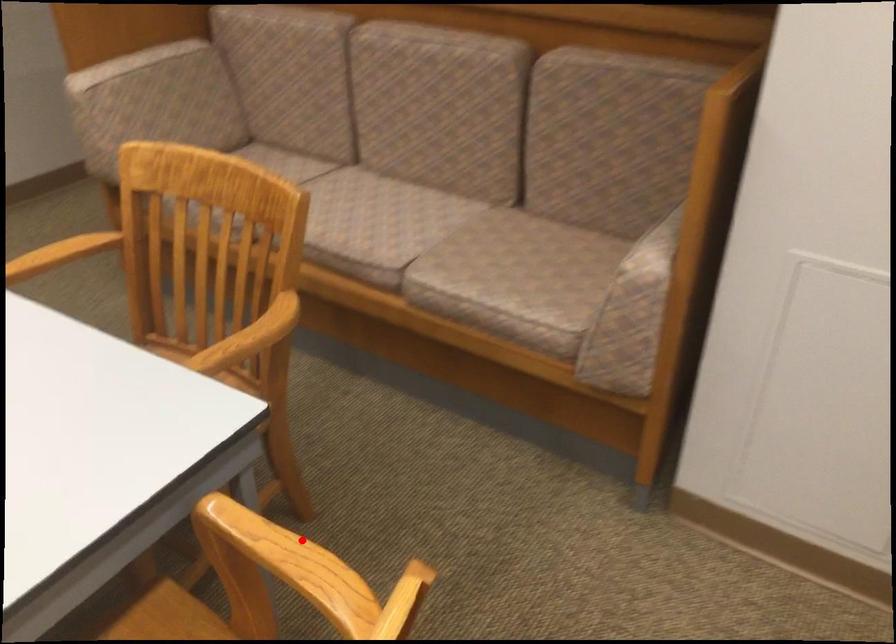
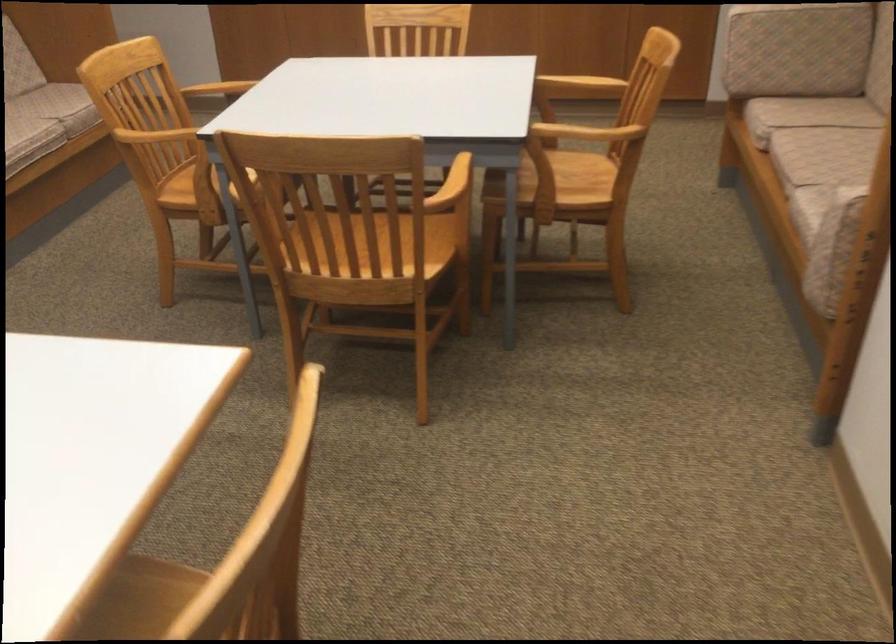
Question: A red point is marked in image1. In image2, is the corresponding 3D point closer to the camera or farther? Reply with the corresponding letter.

Choices:
 (A) The corresponding 3D point is closer.
 (B) The corresponding 3D point is farther.

Answer: (B)